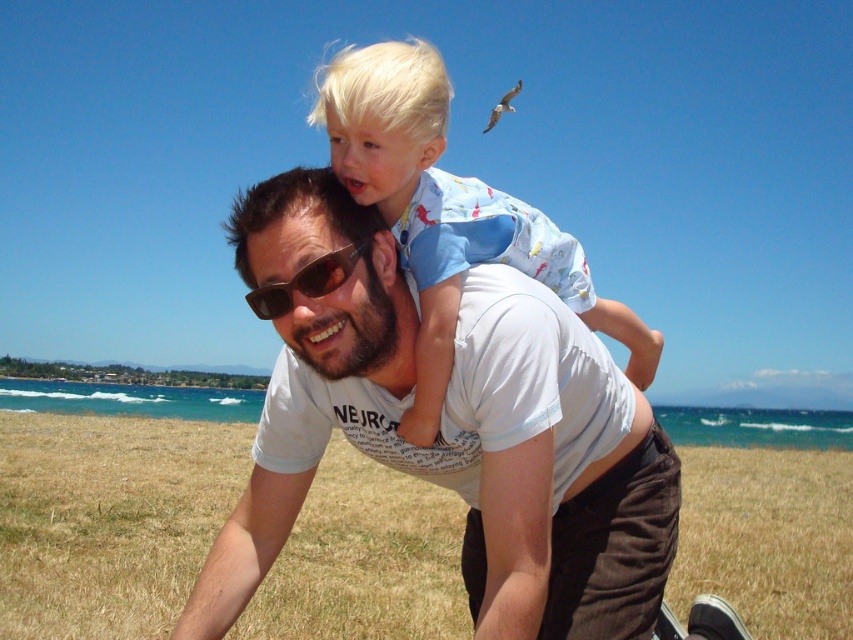
Question: Does white cotton shirt at center have a smaller size compared to light blue cotton shirt at center?

Choices:
 (A) no
 (B) yes

Answer: (B)

Question: Does white cotton shirt at center have a larger size compared to light blue cotton shirt at center?

Choices:
 (A) no
 (B) yes

Answer: (A)

Question: Does white cotton shirt at center appear on the left side of light blue cotton shirt at center?

Choices:
 (A) no
 (B) yes

Answer: (A)